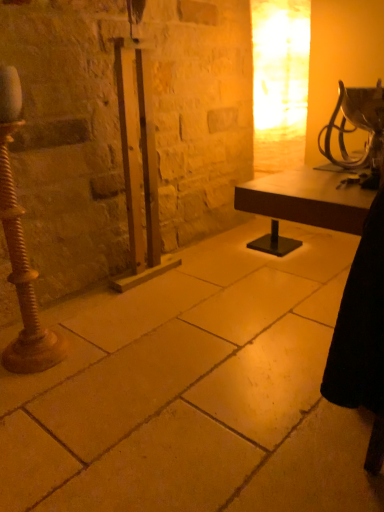
Locate an element on the screen. vacant area situated below metallic silver table lamp at upper right (from a real-world perspective) is located at coordinates (314, 328).